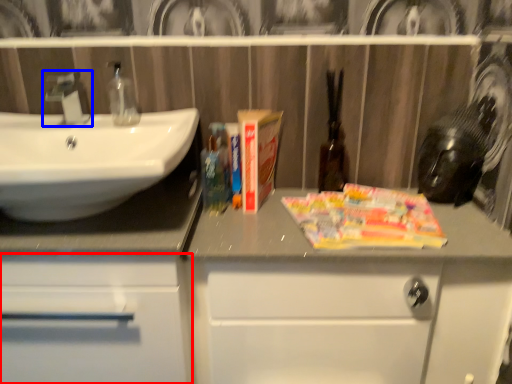
Question: Which object is further to the camera taking this photo, bathroom cabinet (highlighted by a red box) or tap (highlighted by a blue box)?

Choices:
 (A) bathroom cabinet
 (B) tap

Answer: (B)